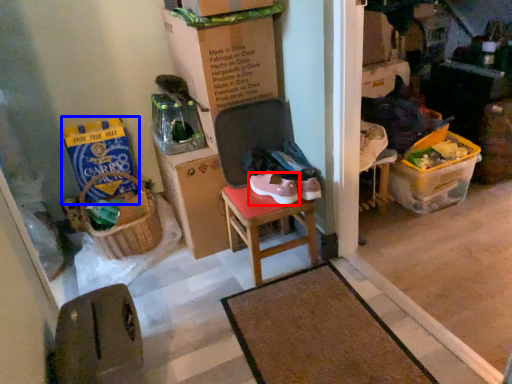
Question: Which of the following is the farthest to the observer, footwear (highlighted by a red box) or box (highlighted by a blue box)?

Choices:
 (A) footwear
 (B) box

Answer: (B)